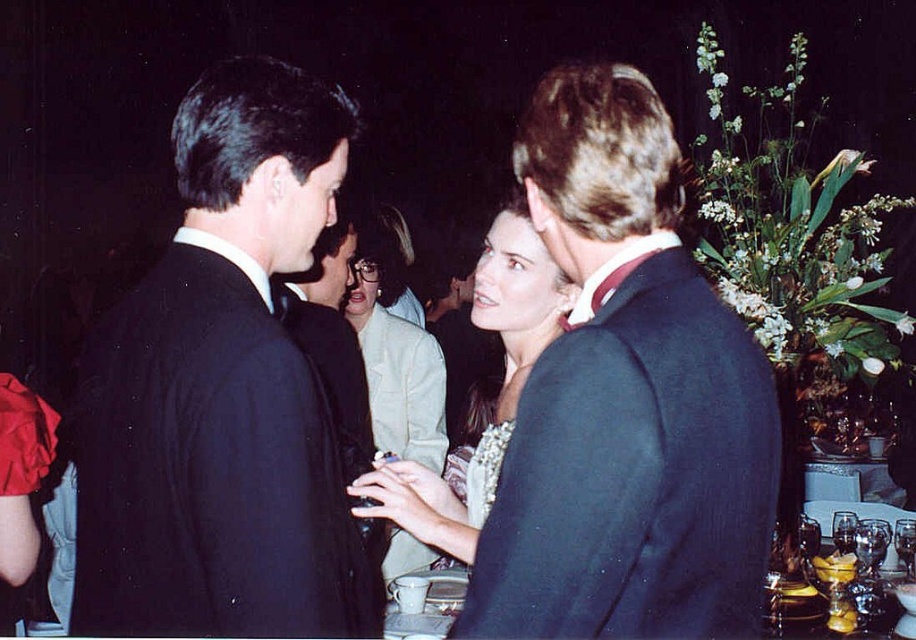
Between matte black suit at left and shiny silver necklace at center, which one appears on the left side from the viewer's perspective?

matte black suit at left

Is the position of matte black suit at left less distant than that of shiny silver necklace at center?

No, it is behind shiny silver necklace at center.

Who is more forward, (192, 620) or (518, 212)?

Positioned in front is point (192, 620).

Locate an element on the screen. matte black suit at left is located at coordinates (221, 392).

Who is positioned more to the right, matte black suit at left or dark blue wool suit at center?

Positioned to the right is dark blue wool suit at center.

Consider the image. Can you confirm if matte black suit at left is taller than dark blue wool suit at center?

Indeed, matte black suit at left has a greater height compared to dark blue wool suit at center.

Which is in front, point (139, 476) or point (607, 340)?

Positioned in front is point (607, 340).

The image size is (916, 640). What are the coordinates of `matte black suit at left` in the screenshot? It's located at (221, 392).

Can you confirm if dark blue wool suit at center is bigger than shiny silver necklace at center?

No.

Does dark blue wool suit at center have a greater width compared to shiny silver necklace at center?

No, dark blue wool suit at center is not wider than shiny silver necklace at center.

Is point (474, 577) positioned behind point (363, 508)?

No, it is not.

This screenshot has height=640, width=916. In order to click on dark blue wool suit at center in this screenshot , I will do `click(635, 474)`.